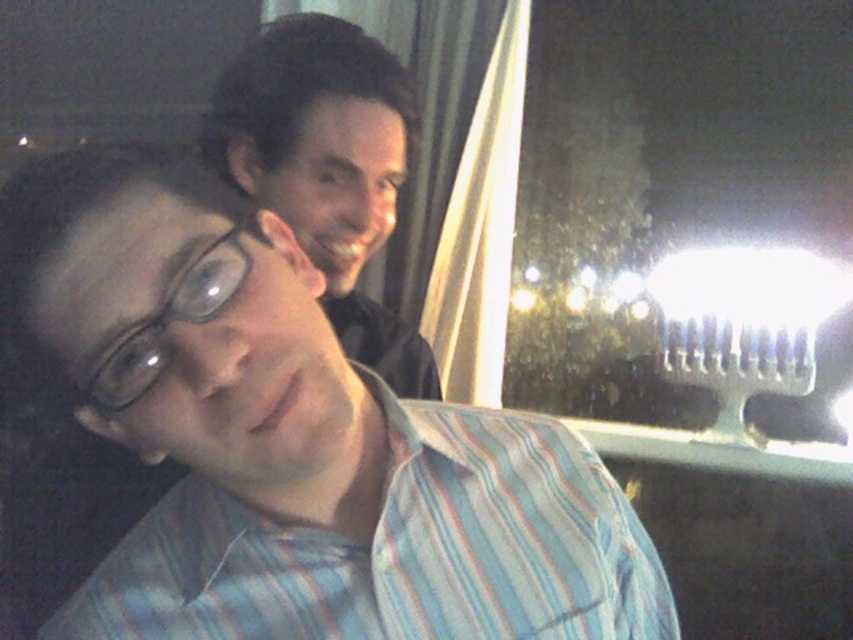
Question: Does striped cotton shirt at center have a greater width compared to transparent plastic glasses at upper left?

Choices:
 (A) yes
 (B) no

Answer: (A)

Question: Among these objects, which one is nearest to the camera?

Choices:
 (A) matte black shirt at upper center
 (B) striped cotton shirt at center
 (C) transparent plastic glasses at upper left

Answer: (C)

Question: Which of these objects is positioned closest to the transparent plastic glasses at upper left?

Choices:
 (A) matte black shirt at upper center
 (B) striped cotton shirt at center

Answer: (B)

Question: Which point is farther from the camera taking this photo?

Choices:
 (A) (212, 276)
 (B) (223, 600)

Answer: (B)

Question: Can you confirm if matte black shirt at upper center is wider than transparent plastic glasses at upper left?

Choices:
 (A) no
 (B) yes

Answer: (B)

Question: Is striped cotton shirt at center in front of matte black shirt at upper center?

Choices:
 (A) no
 (B) yes

Answer: (B)